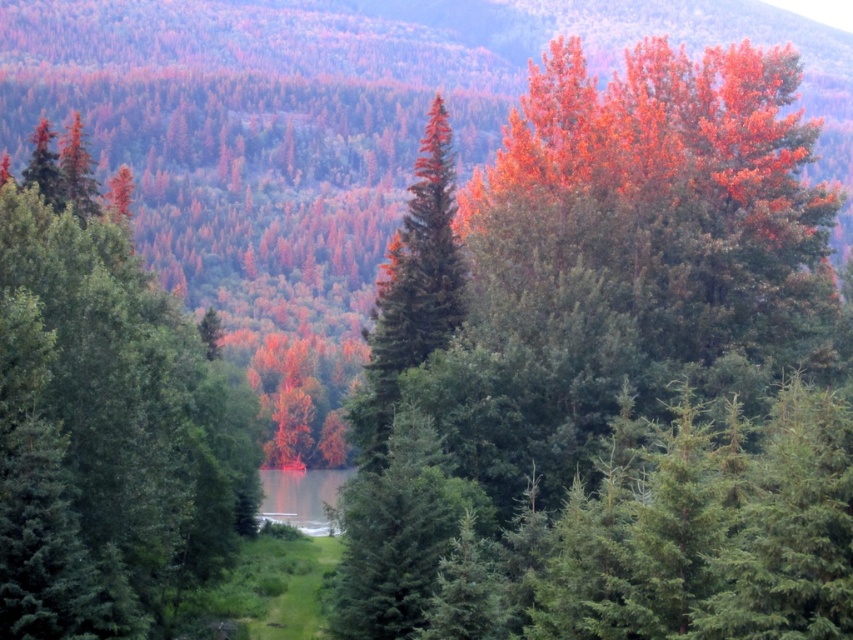
You are standing at the point marked by the coordinates point (624, 376) in the image. What is the dominant color of the foliage you are surrounded by?

The point (624, 376) marks orange red foliage at center, so the dominant color of the foliage you are surrounded by is orange red.